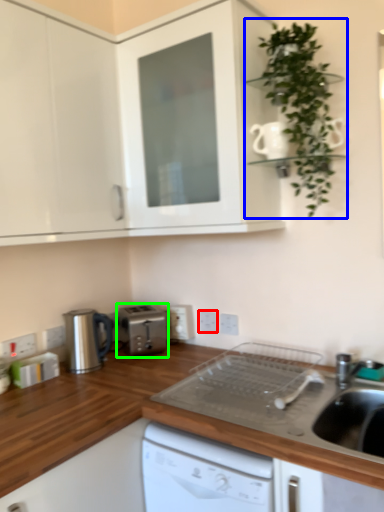
Question: Based on their relative distances, which object is farther from electric outlet (highlighted by a red box)? Choose from houseplant (highlighted by a blue box) and kitchen appliance (highlighted by a green box).

Choices:
 (A) houseplant
 (B) kitchen appliance

Answer: (A)